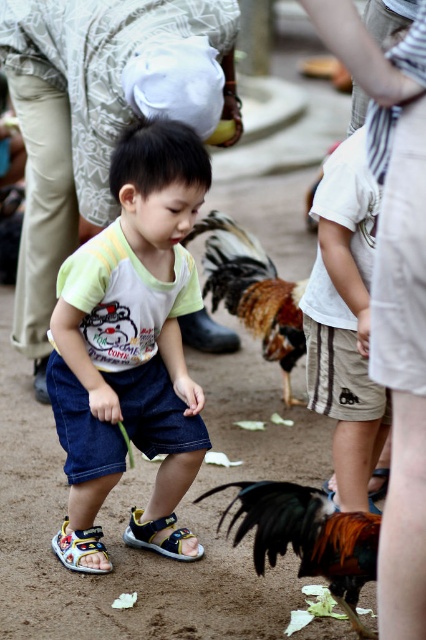
Is denim shorts at center thinner than brown feathered rooster at center?

Yes, denim shorts at center is thinner than brown feathered rooster at center.

Between denim shorts at center and brown feathered rooster at center, which one has more height?

With more height is denim shorts at center.

Who is more distant from viewer, (86, 500) or (270, 298)?

The point (270, 298) is more distant.

At what (x,y) coordinates should I click in order to perform the action: click on denim shorts at center. Please return your answer as a coordinate pair (x, y). The image size is (426, 640). Looking at the image, I should click on (134, 337).

Can you confirm if brown feathered rooster at center is positioned to the right of blue fabric sandal at lower center?

Indeed, brown feathered rooster at center is positioned on the right side of blue fabric sandal at lower center.

Can you confirm if brown feathered rooster at center is positioned above blue fabric sandal at lower center?

Yes.

This screenshot has height=640, width=426. I want to click on brown feathered rooster at center, so click(253, 291).

Can you confirm if blue fabric sandal at lower center is positioned below multicolored fabric sandal at lower left?

No.

Does blue fabric sandal at lower center have a greater height compared to multicolored fabric sandal at lower left?

In fact, blue fabric sandal at lower center may be shorter than multicolored fabric sandal at lower left.

Locate an element on the screen. This screenshot has height=640, width=426. blue fabric sandal at lower center is located at coordinates (155, 532).

You are a GUI agent. You are given a task and a screenshot of the screen. Output one action in this format:
    pyautogui.click(x=<x>, y=<y>)
    Task: Click on the blue fabric sandal at lower center
    
    Given the screenshot: What is the action you would take?
    click(155, 532)